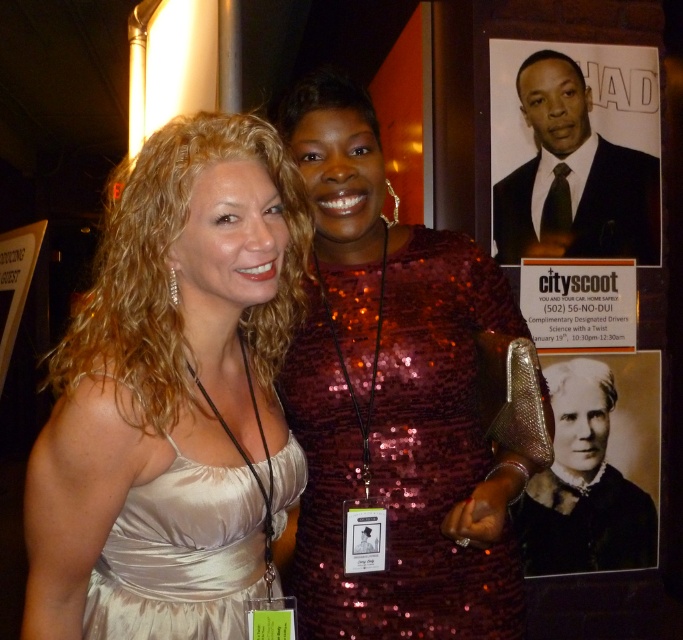
Who is taller, matte black suit at upper right or matte white sign at upper right?

With more height is matte black suit at upper right.

Which is behind, point (559, 77) or point (630, 323)?

The point (630, 323) is more distant.

Image resolution: width=683 pixels, height=640 pixels. In order to click on matte black suit at upper right in this screenshot , I will do `click(572, 177)`.

Does satin dress at center have a smaller size compared to matte black suit at upper right?

Yes.

You are a GUI agent. You are given a task and a screenshot of the screen. Output one action in this format:
    pyautogui.click(x=<x>, y=<y>)
    Task: Click on the satin dress at center
    Image resolution: width=683 pixels, height=640 pixels.
    Given the screenshot: What is the action you would take?
    pyautogui.click(x=191, y=548)

Describe the element at coordinates (572, 177) in the screenshot. This screenshot has width=683, height=640. I see `matte black suit at upper right` at that location.

Does point (553, 216) come behind point (546, 566)?

No, (553, 216) is closer to viewer.

Who is more forward, (546, 112) or (571, 497)?

Point (546, 112) is in front.

The height and width of the screenshot is (640, 683). I want to click on matte black suit at upper right, so click(x=572, y=177).